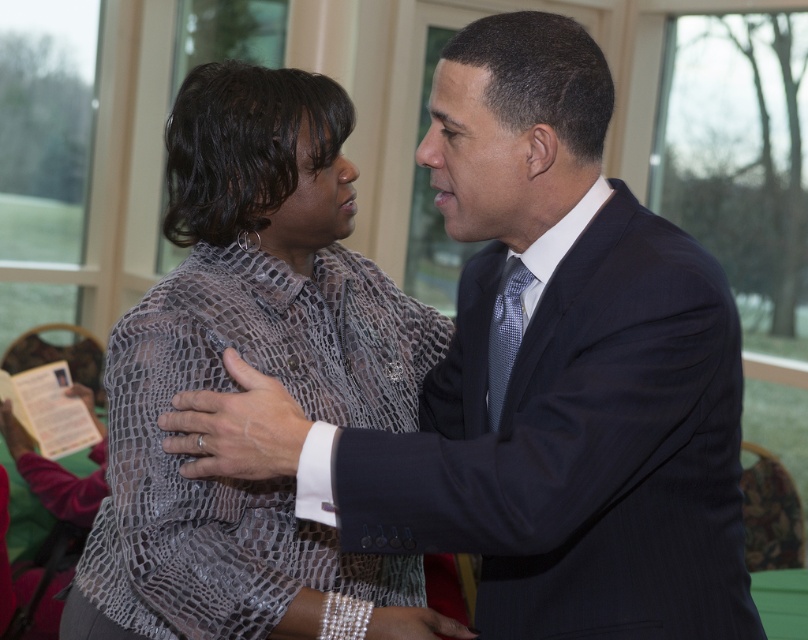
Which is behind, point (596, 509) or point (503, 397)?

Positioned behind is point (503, 397).

Who is more forward, (632, 273) or (499, 406)?

Point (632, 273)

Which is in front, point (508, 12) or point (495, 410)?

Point (508, 12) is in front.

The width and height of the screenshot is (808, 640). I want to click on dark blue suit at center, so click(537, 378).

This screenshot has width=808, height=640. Describe the element at coordinates (259, 369) in the screenshot. I see `matte snakeskin blouse at center` at that location.

Looking at this image, is matte snakeskin blouse at center further to the viewer compared to silvery textured tie at center?

Yes, matte snakeskin blouse at center is further from the viewer.

Who is more forward, [272,288] or [507,330]?

Point [507,330] is in front.

The image size is (808, 640). Find the location of `matte snakeskin blouse at center`. matte snakeskin blouse at center is located at coordinates (259, 369).

Who is more distant from viewer, (x=428, y=444) or (x=121, y=460)?

The point (x=121, y=460) is more distant.

What do you see at coordinates (537, 378) in the screenshot?
I see `dark blue suit at center` at bounding box center [537, 378].

Is point (480, 632) closer to viewer compared to point (217, 273)?

Yes.

The width and height of the screenshot is (808, 640). I want to click on dark blue suit at center, so click(x=537, y=378).